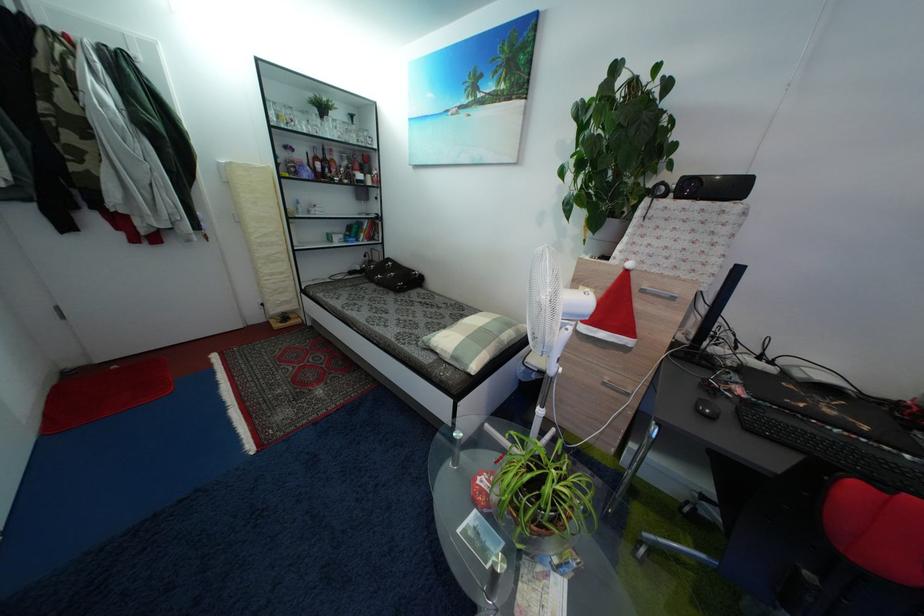
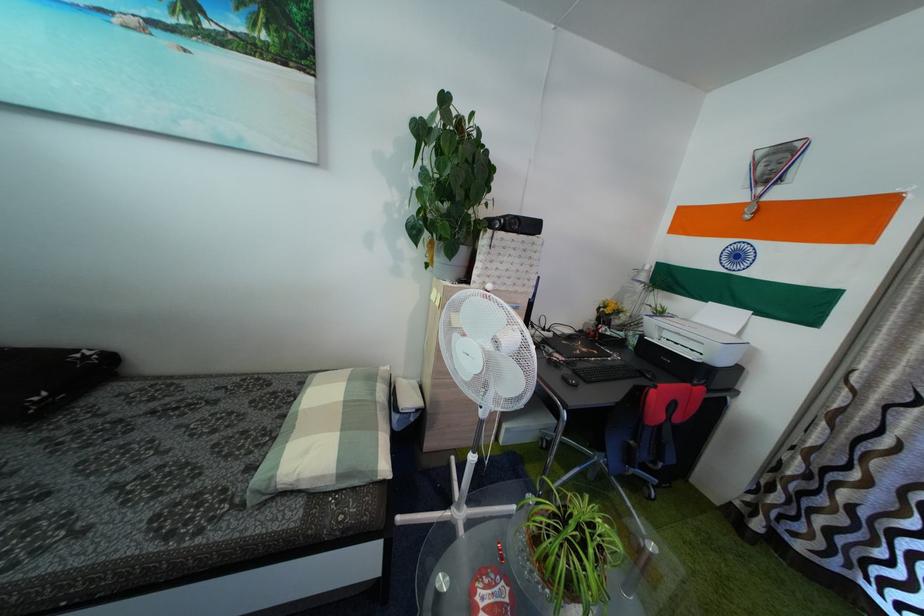
Find the pixel in the second image that matches (462,363) in the first image.

(347, 483)